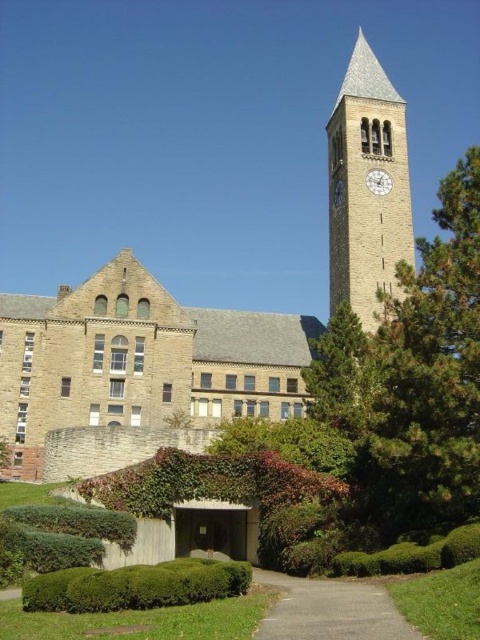
Does point (422, 342) come farther from viewer compared to point (374, 180)?

No, it is not.

Is green textured pine tree at right thinner than gold metallic clock at upper right?

No.

Who is more forward, (441,364) or (370,188)?

Point (441,364) is more forward.

Locate an element on the screen. The width and height of the screenshot is (480, 640). green textured pine tree at right is located at coordinates point(428,378).

Can you confirm if brown stone church at center is wider than green textured tree at center right?

Indeed, brown stone church at center has a greater width compared to green textured tree at center right.

Between brown stone church at center and green textured tree at center right, which one appears on the left side from the viewer's perspective?

brown stone church at center is more to the left.

Where is `brown stone church at center`? Image resolution: width=480 pixels, height=640 pixels. brown stone church at center is located at coordinates (140, 360).

Identify the location of brown stone church at center. (x=140, y=360).

From the picture: Does sandstone clock tower at upper right have a greater height compared to green leafy hedge at lower center?

Yes, sandstone clock tower at upper right is taller than green leafy hedge at lower center.

Who is taller, sandstone clock tower at upper right or green leafy hedge at lower center?

sandstone clock tower at upper right

Does point (359, 161) lie in front of point (59, 576)?

No.

Where is `sandstone clock tower at upper right`? Image resolution: width=480 pixels, height=640 pixels. sandstone clock tower at upper right is located at coordinates [365, 186].